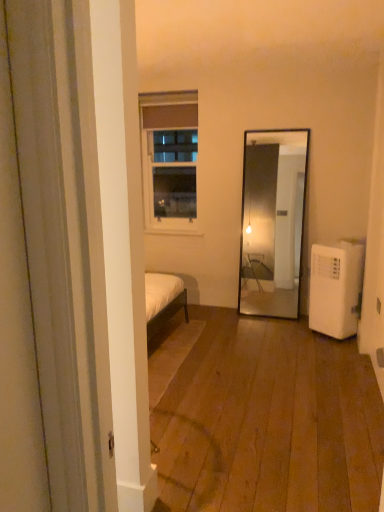
The height and width of the screenshot is (512, 384). I want to click on vacant region to the left of white plastic air conditioner at lower right, so click(283, 331).